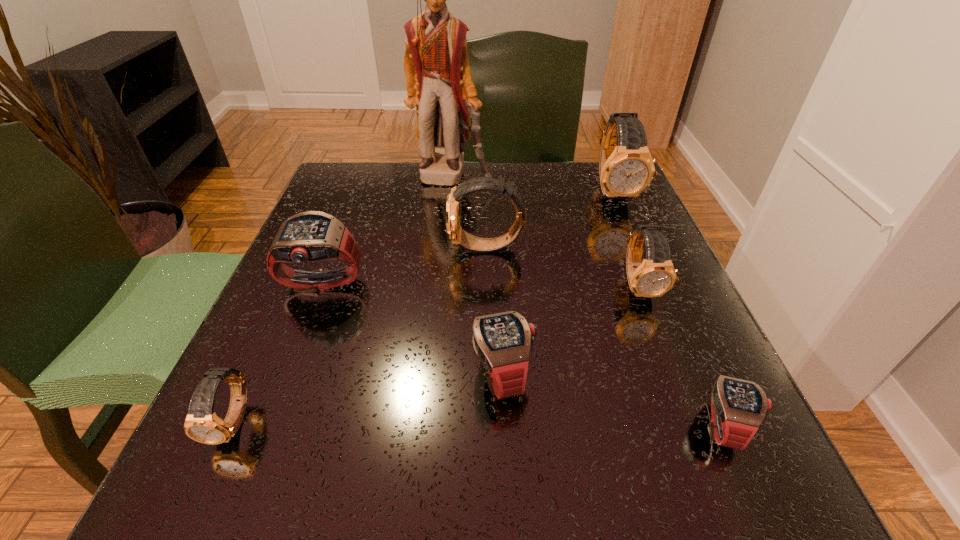
At what (x,y) coordinates should I click in order to perform the action: click on vacant space in between the nutcracker and the biggest red watch. Please return your answer as a coordinate pair (x, y). The width and height of the screenshot is (960, 540). Looking at the image, I should click on pyautogui.click(x=387, y=232).

Where is `vacant space that's between the second biggest red watch and the rightmost red watch`? The width and height of the screenshot is (960, 540). vacant space that's between the second biggest red watch and the rightmost red watch is located at coordinates (613, 400).

Identify the location of free space between the second red watch from left to right and the smallest red watch. (613, 400).

You are a GUI agent. You are given a task and a screenshot of the screen. Output one action in this format:
    pyautogui.click(x=<x>, y=<y>)
    Task: Click on the vacant space in between the shortest watch and the nearest gold watch
    This screenshot has width=960, height=540.
    Given the screenshot: What is the action you would take?
    pyautogui.click(x=480, y=423)

This screenshot has width=960, height=540. What are the coordinates of `empty location between the tallest object and the second smallest gold watch` in the screenshot? It's located at (545, 232).

The image size is (960, 540). I want to click on object that can be found as the third closest to the second farthest gold watch, so click(x=436, y=64).

The width and height of the screenshot is (960, 540). In order to click on object that is the closest one to the second red watch from left to right in this screenshot , I will do `click(655, 275)`.

Identify which watch is the fourth closest to the second red watch from right to left. Please provide its 2D coordinates. Your answer should be formatted as a tuple, i.e. [(x, y)], where the tuple contains the x and y coordinates of a point satisfying the conditions above.

[(738, 407)]

I want to click on watch that can be found as the fifth closest to the smallest red watch, so click(x=307, y=237).

Image resolution: width=960 pixels, height=540 pixels. What are the coordinates of `the third closest gold watch to the biggest red watch` in the screenshot? It's located at (655, 275).